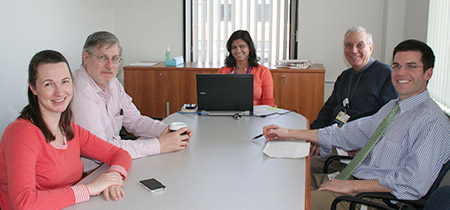
Locate an element on the screen. The height and width of the screenshot is (210, 450). white table is located at coordinates (231, 175).